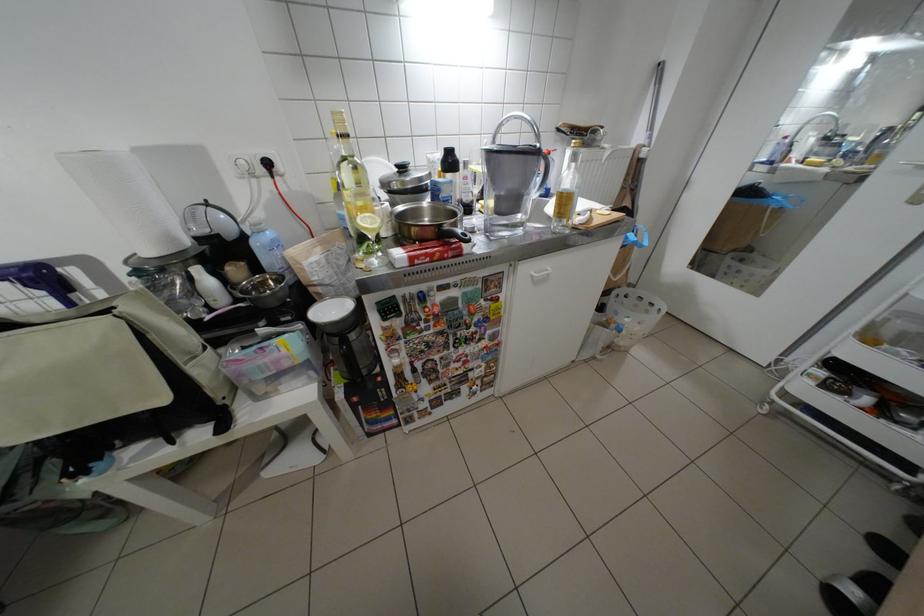
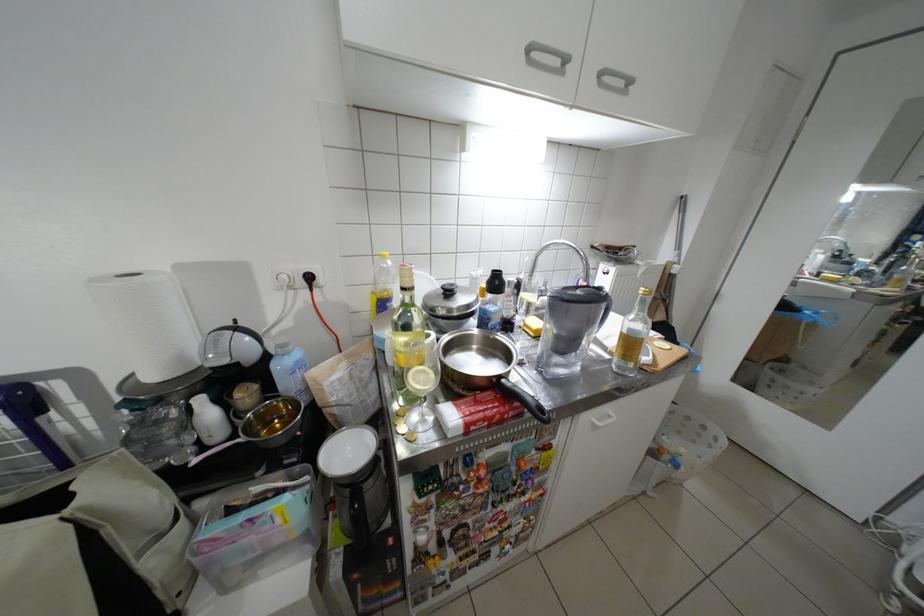
Find the pixel in the second image that matches (x=625, y=326) in the first image.

(677, 458)